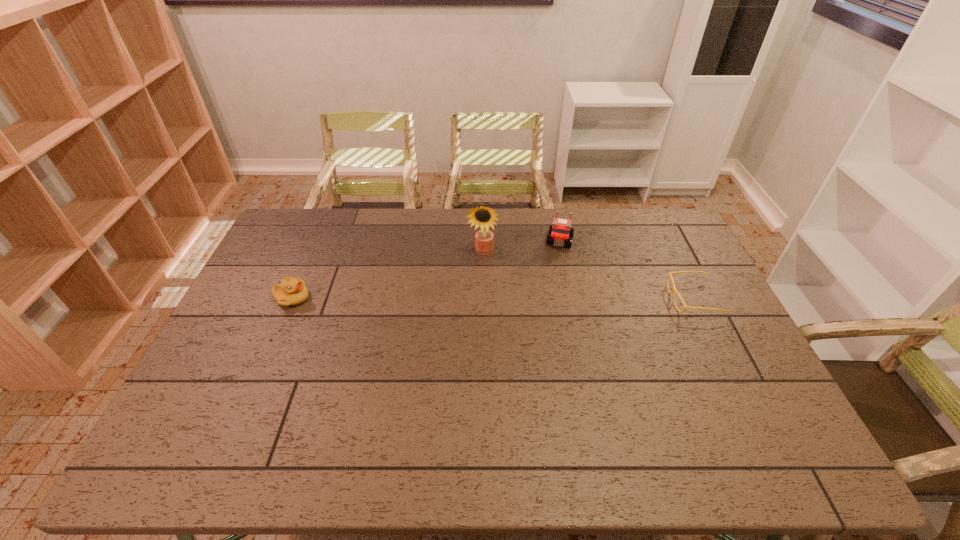
Identify the location of vacant space situated in front of the lenses of the rightmost object. (579, 299).

Locate an element on the screen. free location located in front of the lenses of the rightmost object is located at coordinates click(652, 299).

Where is `blank space located 0.180m on the face of the sunflower`? blank space located 0.180m on the face of the sunflower is located at coordinates (472, 299).

In order to click on free space located on the face of the sunflower in this screenshot , I will do `click(477, 273)`.

Identify the location of free location located on the face of the sunflower. (468, 322).

This screenshot has height=540, width=960. Identify the location of vacant region located 0.210m on the front-facing side of the Lego. (550, 291).

The width and height of the screenshot is (960, 540). Identify the location of vacant space located on the front-facing side of the Lego. (547, 302).

You are a GUI agent. You are given a task and a screenshot of the screen. Output one action in this format:
    pyautogui.click(x=<x>, y=<y>)
    Task: Click on the blank space located 0.120m on the front-facing side of the Lego
    The width and height of the screenshot is (960, 540).
    Given the screenshot: What is the action you would take?
    pyautogui.click(x=554, y=273)

This screenshot has width=960, height=540. I want to click on sunflower located at the far edge, so click(484, 239).

Find the location of a particular element. Lego at the far edge is located at coordinates (560, 232).